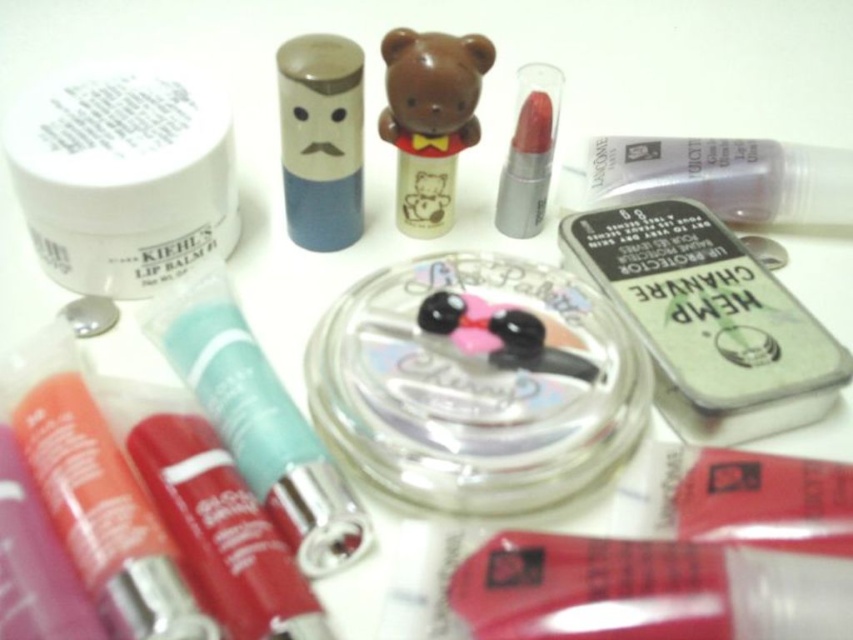
From the picture: Between green matte tin at center-right and clear plastic tube at upper right, which one is positioned lower?

green matte tin at center-right

Between green matte tin at center-right and clear plastic tube at upper right, which one appears on the left side from the viewer's perspective?

green matte tin at center-right is more to the left.

Is point (700, 442) behind point (672, 170)?

No, (700, 442) is closer to viewer.

Locate an element on the screen. The width and height of the screenshot is (853, 640). green matte tin at center-right is located at coordinates point(706,321).

Is white matte jar at upper left to the right of shiny plastic lip balm at lower left from the viewer's perspective?

No, white matte jar at upper left is not to the right of shiny plastic lip balm at lower left.

This screenshot has height=640, width=853. Describe the element at coordinates (125, 177) in the screenshot. I see `white matte jar at upper left` at that location.

In order to click on white matte jar at upper left in this screenshot , I will do `click(125, 177)`.

Between point (463, 289) and point (194, 176), which one is positioned in front?

Point (463, 289) is more forward.

Is clear plastic container at center to the left of white matte jar at upper left from the viewer's perspective?

No, clear plastic container at center is not to the left of white matte jar at upper left.

Locate an element on the screen. clear plastic container at center is located at coordinates (474, 387).